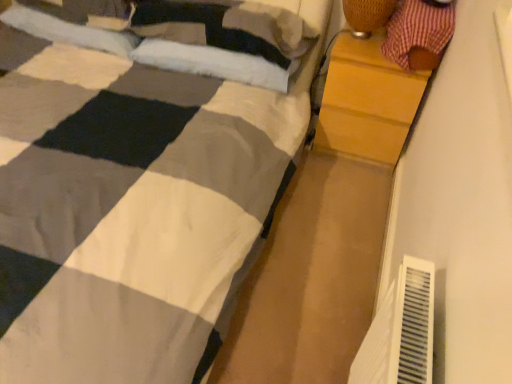
Question: Is soft white pillow at upper left, positioned as the 3th pillow in right-to-left order, positioned behind white soft pillow at upper center, which is counted as the first pillow, starting from the right?

Choices:
 (A) yes
 (B) no

Answer: (A)

Question: From the image's perspective, does soft white pillow at upper left, the first pillow in the left-to-right sequence, appear lower than white soft pillow at upper center, which ranks as the third pillow in left-to-right order?

Choices:
 (A) no
 (B) yes

Answer: (A)

Question: Considering the relative sizes of soft white pillow at upper left, the first pillow in the left-to-right sequence, and white soft pillow at upper center, which ranks as the third pillow in left-to-right order, in the image provided, is soft white pillow at upper left, the first pillow in the left-to-right sequence, bigger than white soft pillow at upper center, which ranks as the third pillow in left-to-right order,?

Choices:
 (A) yes
 (B) no

Answer: (B)

Question: From the image's perspective, is soft white pillow at upper left, positioned as the 3th pillow in right-to-left order, on top of white soft pillow at upper center, which ranks as the third pillow in left-to-right order?

Choices:
 (A) yes
 (B) no

Answer: (A)

Question: Would you say white soft pillow at upper center, which is counted as the first pillow, starting from the right, is part of soft white pillow at upper left, positioned as the 3th pillow in right-to-left order,'s contents?

Choices:
 (A) no
 (B) yes

Answer: (A)

Question: Is soft white pillow at upper left, positioned as the 3th pillow in right-to-left order, closer to the viewer compared to white soft pillow at upper center, which ranks as the third pillow in left-to-right order?

Choices:
 (A) yes
 (B) no

Answer: (B)

Question: From the image's perspective, does white soft pillow at upper center, which is counted as the first pillow, starting from the right, appear higher than soft white pillow at upper left, which is counted as the 2th pillow, starting from the right?

Choices:
 (A) yes
 (B) no

Answer: (B)

Question: Would you say white soft pillow at upper center, which ranks as the third pillow in left-to-right order, contains soft white pillow at upper left, which is counted as the 2th pillow, starting from the right?

Choices:
 (A) yes
 (B) no

Answer: (B)

Question: Does white soft pillow at upper center, which is counted as the first pillow, starting from the right, have a larger size compared to soft white pillow at upper left, positioned as the second pillow in left-to-right order?

Choices:
 (A) no
 (B) yes

Answer: (A)

Question: Is white soft pillow at upper center, which ranks as the third pillow in left-to-right order, facing away from soft white pillow at upper left, positioned as the second pillow in left-to-right order?

Choices:
 (A) yes
 (B) no

Answer: (B)

Question: From a real-world perspective, is white soft pillow at upper center, which is counted as the first pillow, starting from the right, over soft white pillow at upper left, which is counted as the 2th pillow, starting from the right?

Choices:
 (A) no
 (B) yes

Answer: (A)

Question: Can we say white soft pillow at upper center, which ranks as the third pillow in left-to-right order, lies outside soft white pillow at upper left, which is counted as the 2th pillow, starting from the right?

Choices:
 (A) no
 (B) yes

Answer: (B)

Question: Does soft white pillow at upper left, positioned as the second pillow in left-to-right order, appear on the left side of woven bamboo lampshade at upper right?

Choices:
 (A) yes
 (B) no

Answer: (A)